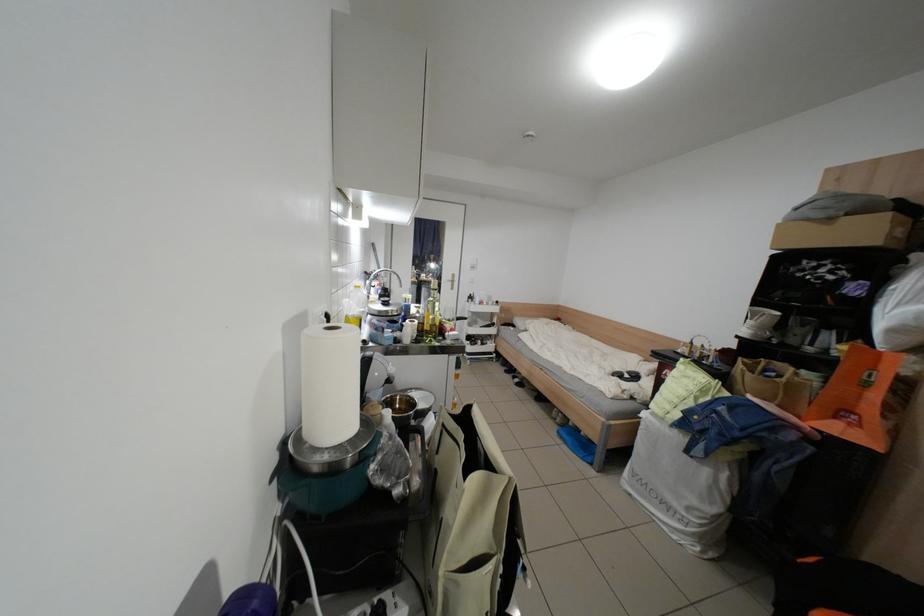
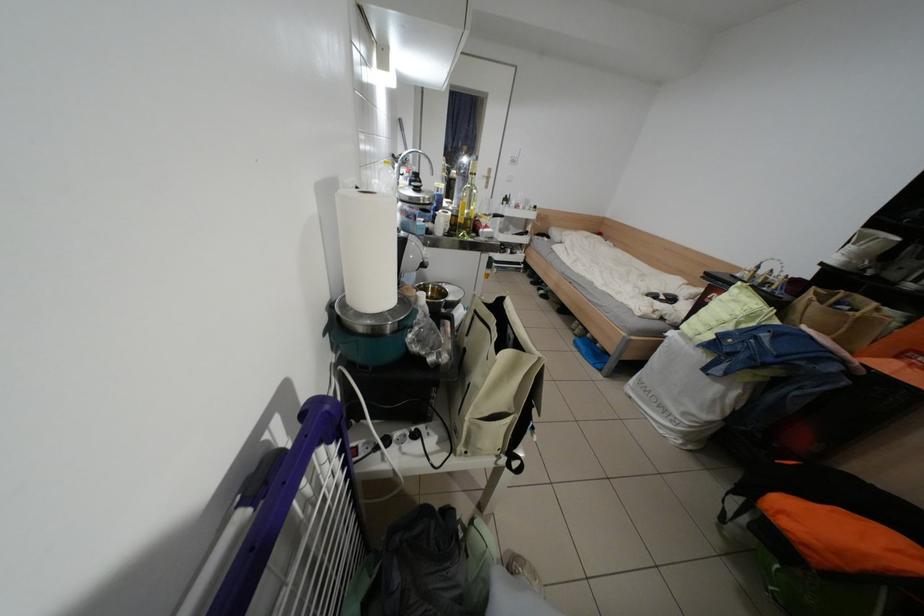
Locate, in the second image, the point that corresponds to (x=399, y=416) in the first image.

(433, 297)